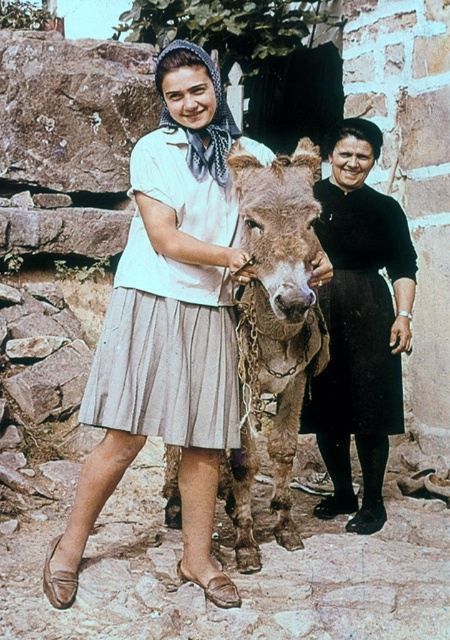
Question: Among these objects, which one is nearest to the camera?

Choices:
 (A) light beige pleated skirt at center
 (B) brown rough textured mule at center
 (C) white cotton shirt at center

Answer: (B)

Question: Which object appears closest to the camera in this image?

Choices:
 (A) light beige pleated skirt at center
 (B) black velvet skirt at right

Answer: (A)

Question: Is light beige pleated skirt at center below brown rough textured mule at center?

Choices:
 (A) no
 (B) yes

Answer: (A)

Question: Does white cotton shirt at center have a greater width compared to light beige pleated skirt at center?

Choices:
 (A) no
 (B) yes

Answer: (B)

Question: Is the position of white cotton shirt at center less distant than that of light beige pleated skirt at center?

Choices:
 (A) yes
 (B) no

Answer: (A)

Question: Which object appears farthest from the camera in this image?

Choices:
 (A) black velvet skirt at right
 (B) light beige pleated skirt at center

Answer: (A)